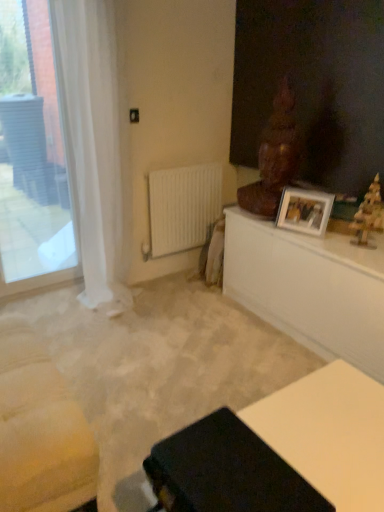
Locate an element on the screen. This screenshot has width=384, height=512. matte black table at lower center, which is counted as the first table, starting from the bottom is located at coordinates (293, 446).

The width and height of the screenshot is (384, 512). In order to click on white glossy table at upper right, the 1th table when ordered from back to front in this screenshot , I will do `click(309, 288)`.

What do you see at coordinates (309, 288) in the screenshot? I see `white glossy table at upper right, the second table in the bottom-to-top sequence` at bounding box center [309, 288].

Describe the element at coordinates (183, 207) in the screenshot. I see `white matte radiator at center` at that location.

Describe the element at coordinates (304, 211) in the screenshot. This screenshot has width=384, height=512. I see `white glossy picture frame at upper right` at that location.

What is the approximate width of white sheer curtain at left?

white sheer curtain at left is 36.78 centimeters in width.

Find the location of a particular element. Image resolution: width=384 pixels, height=512 pixels. white sheer curtain at left is located at coordinates (93, 143).

Locate an element on the screen. The image size is (384, 512). transparent glass window at left is located at coordinates (33, 157).

From a real-world perspective, is wooden christmas tree at right, which is the second sculpture in left-to-right order, located higher than white matte radiator at center?

Yes, from a real-world perspective, wooden christmas tree at right, which is the second sculpture in left-to-right order, is above white matte radiator at center.

Can you confirm if wooden christmas tree at right, the 1th sculpture positioned from the right, is taller than white matte radiator at center?

No.

How many degrees apart are the facing directions of wooden christmas tree at right, marked as the first sculpture in a front-to-back arrangement, and white matte radiator at center?

There is a 72.4-degree angle between the facing directions of wooden christmas tree at right, marked as the first sculpture in a front-to-back arrangement, and white matte radiator at center.

From the image's perspective, is wooden christmas tree at right, marked as the first sculpture in a front-to-back arrangement, located beneath white matte radiator at center?

Correct, wooden christmas tree at right, marked as the first sculpture in a front-to-back arrangement, appears lower than white matte radiator at center in the image.

From a real-world perspective, who is located lower, white glossy picture frame at upper right or matte black table at lower center, the 1th table viewed from the front?

In real-world perspective, matte black table at lower center, the 1th table viewed from the front, is lower.

Considering the relative positions of white glossy picture frame at upper right and matte black table at lower center, the 1th table viewed from the front, in the image provided, is white glossy picture frame at upper right to the left of matte black table at lower center, the 1th table viewed from the front, from the viewer's perspective?

Incorrect, white glossy picture frame at upper right is not on the left side of matte black table at lower center, the 1th table viewed from the front.

Does point (294, 219) come closer to viewer compared to point (307, 460)?

No, (294, 219) is behind (307, 460).

Is white glossy picture frame at upper right next to matte black table at lower center, the 2th table from the top, and touching it?

No, white glossy picture frame at upper right is not making contact with matte black table at lower center, the 2th table from the top.

Considering the sizes of objects matte black table at lower center, marked as the second table in a back-to-front arrangement, and wooden christmas tree at right, which is the second sculpture in left-to-right order, in the image provided, who is smaller, matte black table at lower center, marked as the second table in a back-to-front arrangement, or wooden christmas tree at right, which is the second sculpture in left-to-right order,?

With smaller size is wooden christmas tree at right, which is the second sculpture in left-to-right order.

What's the angular difference between matte black table at lower center, marked as the second table in a back-to-front arrangement, and wooden christmas tree at right, arranged as the 2th sculpture when viewed from the back,'s facing directions?

The facing directions of matte black table at lower center, marked as the second table in a back-to-front arrangement, and wooden christmas tree at right, arranged as the 2th sculpture when viewed from the back, are 17.8 degrees apart.

Is the surface of matte black table at lower center, the 2th table from the top, in direct contact with wooden christmas tree at right, marked as the first sculpture in a front-to-back arrangement?

They are not placed beside each other.

Looking at the image, does white matte radiator at center seem bigger or smaller compared to white glossy picture frame at upper right?

Clearly, white matte radiator at center is larger in size than white glossy picture frame at upper right.

Is the depth of white matte radiator at center less than that of white glossy picture frame at upper right?

No, it is not.

Can white glossy picture frame at upper right be found inside white matte radiator at center?

No.

Based on the photo, is white matte radiator at center at the left side of white glossy picture frame at upper right?

Yes.

Is white matte radiator at center located outside matte black table at lower center, marked as the second table in a back-to-front arrangement?

white matte radiator at center lies outside matte black table at lower center, marked as the second table in a back-to-front arrangement,'s area.

How far apart are white matte radiator at center and matte black table at lower center, the 1th table viewed from the front?

A distance of 1.72 meters exists between white matte radiator at center and matte black table at lower center, the 1th table viewed from the front.

Based on the photo, from the image's perspective, is white matte radiator at center beneath matte black table at lower center, marked as the second table in a back-to-front arrangement?

No, from the image's perspective, white matte radiator at center is not beneath matte black table at lower center, marked as the second table in a back-to-front arrangement.

Between white matte radiator at center and matte black table at lower center, the 1th table viewed from the front, which one appears on the left side from the viewer's perspective?

white matte radiator at center.

Identify the location of curtain located on the left of matte black table at lower center, which is counted as the first table, starting from the bottom. (93, 143).

Could you tell me if white sheer curtain at left is turned towards matte black table at lower center, the 1th table viewed from the front?

Yes, white sheer curtain at left is aimed at matte black table at lower center, the 1th table viewed from the front.

Does white sheer curtain at left appear on the left side of matte black table at lower center, the 1th table viewed from the front?

Correct, you'll find white sheer curtain at left to the left of matte black table at lower center, the 1th table viewed from the front.

From a real-world perspective, is white sheer curtain at left located beneath matte black table at lower center, marked as the second table in a back-to-front arrangement?

No, from a real-world perspective, white sheer curtain at left is not beneath matte black table at lower center, marked as the second table in a back-to-front arrangement.

From the image's perspective, who appears lower, wooden statue at upper right, which ranks as the second sculpture in front-to-back order, or matte black table at lower center, the 2th table from the top?

matte black table at lower center, the 2th table from the top.

Is wooden statue at upper right, which ranks as the second sculpture in front-to-back order, positioned far away from matte black table at lower center, which is counted as the first table, starting from the bottom?

That's right, there is a large distance between wooden statue at upper right, which ranks as the second sculpture in front-to-back order, and matte black table at lower center, which is counted as the first table, starting from the bottom.

Is matte black table at lower center, marked as the second table in a back-to-front arrangement, at the back of wooden statue at upper right, the 1th sculpture positioned from the left?

wooden statue at upper right, the 1th sculpture positioned from the left, is not turned away from matte black table at lower center, marked as the second table in a back-to-front arrangement.

Considering the sizes of objects wooden statue at upper right, which is the first sculpture from back to front, and matte black table at lower center, marked as the second table in a back-to-front arrangement, in the image provided, who is taller, wooden statue at upper right, which is the first sculpture from back to front, or matte black table at lower center, marked as the second table in a back-to-front arrangement,?

wooden statue at upper right, which is the first sculpture from back to front, is taller.

Locate an element on the screen. The height and width of the screenshot is (512, 384). radiator behind the wooden christmas tree at right, marked as the first sculpture in a front-to-back arrangement is located at coordinates (183, 207).

Where is `table lying on the left of white glossy picture frame at upper right`? table lying on the left of white glossy picture frame at upper right is located at coordinates (293, 446).

From the image, which object appears to be farther from wooden christmas tree at right, the 1th sculpture positioned from the right, transparent glass window at left or white sheer curtain at left?

transparent glass window at left is positioned further to the anchor wooden christmas tree at right, the 1th sculpture positioned from the right.

Estimate the real-world distances between objects in this image. Which object is closer to matte black table at lower center, the 1th table viewed from the front, wooden statue at upper right, the second sculpture in the right-to-left sequence, or white glossy table at upper right, the second table in the bottom-to-top sequence?

white glossy table at upper right, the second table in the bottom-to-top sequence, is positioned closer to the anchor matte black table at lower center, the 1th table viewed from the front.

When comparing their distances from transparent glass window at left, does wooden christmas tree at right, marked as the first sculpture in a front-to-back arrangement, or white glossy picture frame at upper right seem further?

wooden christmas tree at right, marked as the first sculpture in a front-to-back arrangement.

From the image, which object appears to be nearer to white sheer curtain at left, wooden christmas tree at right, the 1th sculpture positioned from the right, or white matte radiator at center?

white matte radiator at center is closer to white sheer curtain at left.

In the scene shown: Considering their positions, is transparent glass window at left positioned closer to wooden statue at upper right, which ranks as the second sculpture in front-to-back order, than white glossy table at upper right, which is counted as the 1th table, starting from the top?

white glossy table at upper right, which is counted as the 1th table, starting from the top, is positioned closer to the anchor wooden statue at upper right, which ranks as the second sculpture in front-to-back order.

Looking at this image, based on their spatial positions, is white glossy table at upper right, the 1th table when ordered from back to front, or white glossy picture frame at upper right further from transparent glass window at left?

Among the two, white glossy picture frame at upper right is located further to transparent glass window at left.

Consider the image. When comparing their distances from white glossy picture frame at upper right, does matte black table at lower center, the 2th table from the top, or transparent glass window at left seem closer?

The object closer to white glossy picture frame at upper right is matte black table at lower center, the 2th table from the top.

From the image, which object appears to be farther from wooden statue at upper right, the 1th sculpture positioned from the left, wooden christmas tree at right, the 1th sculpture positioned from the right, or white matte radiator at center?

white matte radiator at center.

This screenshot has width=384, height=512. I want to click on radiator situated between white sheer curtain at left and white glossy table at upper right, which is counted as the 1th table, starting from the top, from left to right, so click(x=183, y=207).

Find the location of a particular element. This screenshot has height=512, width=384. picture frame between white sheer curtain at left and wooden christmas tree at right, arranged as the 2th sculpture when viewed from the back, from left to right is located at coordinates (304, 211).

Where is `sculpture between white matte radiator at center and wooden christmas tree at right, which is the second sculpture in left-to-right order`? This screenshot has width=384, height=512. sculpture between white matte radiator at center and wooden christmas tree at right, which is the second sculpture in left-to-right order is located at coordinates (274, 157).

Locate an element on the screen. sculpture between white sheer curtain at left and white glossy picture frame at upper right is located at coordinates (274, 157).